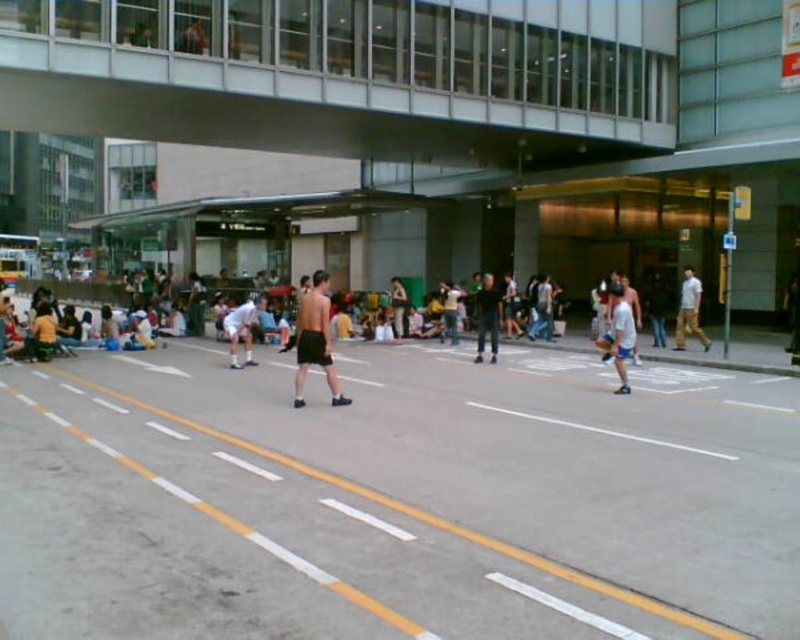
You are a photographer trying to capture a candid shot of the dark blue jeans at center and the white cotton shirt at center during the badminton game. Which of the two items should you focus on first if you want to ensure both are fully in frame without moving the camera?

The dark blue jeans at center occupies less space than the white cotton shirt at center, so you should focus on the white cotton shirt at center first to ensure it fits entirely within the frame before adjusting for the smaller dark blue jeans at center.

You are standing at the origin of the coordinate system. The dark blue jeans at center is located at point (488,316). If you want to move towards the dark blue jeans at center, which direction should you move in?

The dark blue jeans at center is located at point (488,316), so you should move towards the center of the image to reach it.